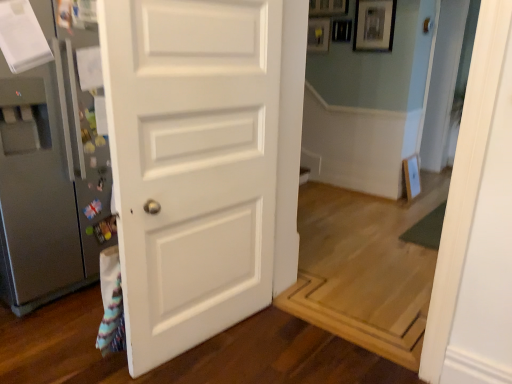
Question: Based on their positions, is silver metallic door handle at center located to the left or right of transparent glass door at upper right?

Choices:
 (A) right
 (B) left

Answer: (B)

Question: From a real-world perspective, is silver metallic door handle at center physically located above or below transparent glass door at upper right?

Choices:
 (A) above
 (B) below

Answer: (A)

Question: Which of these objects is positioned closest to the white matte door at center?

Choices:
 (A) transparent glass door at upper right
 (B) silver metallic door handle at center
 (C) satin silver refrigerator at left
 (D) matte black picture frame at upper center

Answer: (C)

Question: Which object is the closest to the satin silver refrigerator at left?

Choices:
 (A) matte black picture frame at upper center
 (B) transparent glass door at upper right
 (C) silver metallic door handle at center
 (D) white matte door at center

Answer: (D)